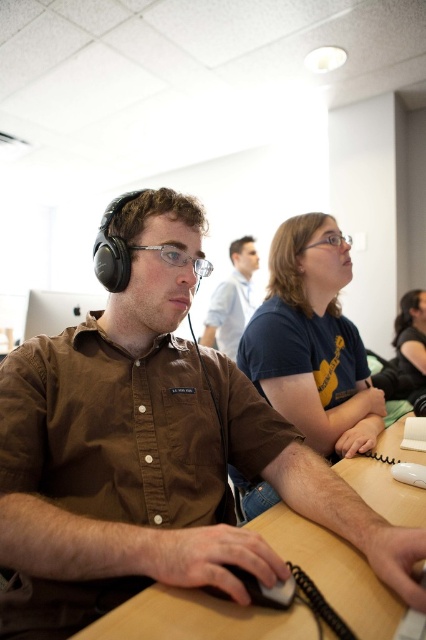
Does matte brown shirt at center have a greater height compared to silver metallic monitor at upper left?

Correct, matte brown shirt at center is much taller as silver metallic monitor at upper left.

Who is more forward, (253, 248) or (63, 328)?

Point (63, 328)

The height and width of the screenshot is (640, 426). Describe the element at coordinates (232, 300) in the screenshot. I see `matte brown shirt at center` at that location.

The height and width of the screenshot is (640, 426). Identify the location of matte brown shirt at center. (232, 300).

Is matte brown shirt at center to the left of black matte mouse at lower center from the viewer's perspective?

Incorrect, matte brown shirt at center is not on the left side of black matte mouse at lower center.

What do you see at coordinates (232, 300) in the screenshot?
I see `matte brown shirt at center` at bounding box center [232, 300].

Is point (233, 276) farther from viewer compared to point (282, 588)?

That is True.

Find the location of `matte brown shirt at center`. matte brown shirt at center is located at coordinates (232, 300).

What do you see at coordinates (232, 300) in the screenshot? I see `matte brown shirt at center` at bounding box center [232, 300].

Between point (227, 348) and point (405, 481), which one is positioned in front?

Point (405, 481) is more forward.

Where is `matte brown shirt at center`? matte brown shirt at center is located at coordinates (232, 300).